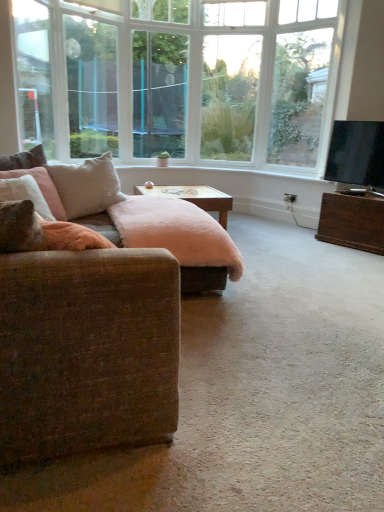
Question: Does textured brown couch at left have a lesser height compared to black glossy tv at right?

Choices:
 (A) no
 (B) yes

Answer: (A)

Question: From the image's perspective, does textured brown couch at left appear lower than black glossy tv at right?

Choices:
 (A) no
 (B) yes

Answer: (B)

Question: Could you tell me if textured brown couch at left is facing black glossy tv at right?

Choices:
 (A) no
 (B) yes

Answer: (B)

Question: Is textured brown couch at left thinner than black glossy tv at right?

Choices:
 (A) yes
 (B) no

Answer: (B)

Question: From the image's perspective, is textured brown couch at left on black glossy tv at right?

Choices:
 (A) no
 (B) yes

Answer: (A)

Question: Is textured brown couch at left far from black glossy tv at right?

Choices:
 (A) yes
 (B) no

Answer: (A)

Question: Is clear glass window screen at upper left, the first window screen viewed from the left, facing away from velvet pink pillow at left, which is the second pillow in right-to-left order?

Choices:
 (A) yes
 (B) no

Answer: (B)

Question: Can you confirm if clear glass window screen at upper left, marked as the second window screen in a right-to-left arrangement, is positioned to the left of velvet pink pillow at left, acting as the first pillow starting from the left?

Choices:
 (A) no
 (B) yes

Answer: (A)

Question: Is clear glass window screen at upper left, the first window screen viewed from the left, bigger than velvet pink pillow at left, acting as the first pillow starting from the left?

Choices:
 (A) no
 (B) yes

Answer: (B)

Question: Is clear glass window screen at upper left, the first window screen viewed from the left, shorter than velvet pink pillow at left, which is the second pillow in right-to-left order?

Choices:
 (A) no
 (B) yes

Answer: (A)

Question: Is clear glass window screen at upper left, marked as the second window screen in a right-to-left arrangement, thinner than velvet pink pillow at left, which is the second pillow in right-to-left order?

Choices:
 (A) no
 (B) yes

Answer: (B)

Question: Is velvet pink pillow at left, which is the second pillow in right-to-left order, surrounded by clear glass window screen at upper left, the first window screen viewed from the left?

Choices:
 (A) yes
 (B) no

Answer: (B)

Question: Would you say fuzzy pink ottoman at center is outside clear glass window screen at center, which ranks as the second window screen in left-to-right order?

Choices:
 (A) yes
 (B) no

Answer: (A)